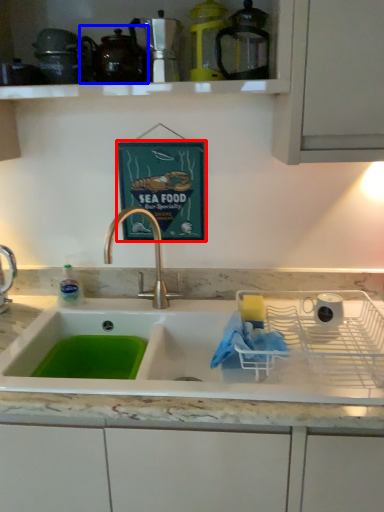
Question: Among these objects, which one is nearest to the camera, picture frame (highlighted by a red box) or tea pot (highlighted by a blue box)?

Choices:
 (A) picture frame
 (B) tea pot

Answer: (B)